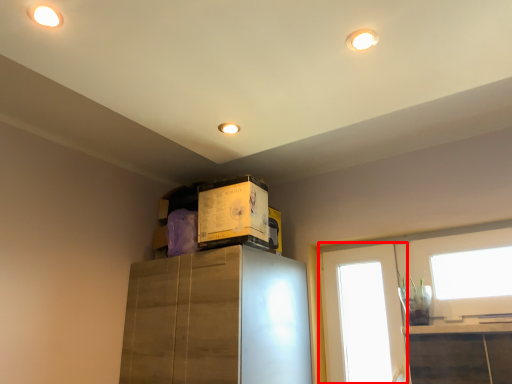
Question: From the image's perspective, what is the correct spatial relationship of window (annotated by the red box) in relation to box?

Choices:
 (A) above
 (B) below

Answer: (B)